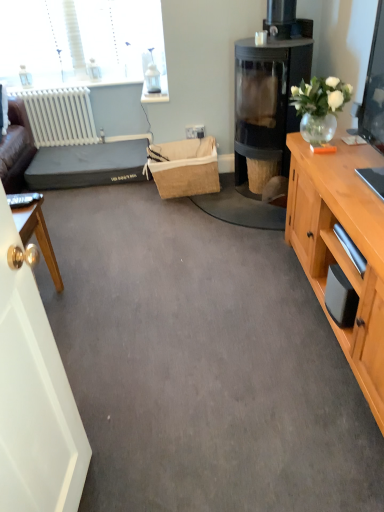
Question: Is white glossy door at left far away from polished wood desk at left?

Choices:
 (A) yes
 (B) no

Answer: (B)

Question: From the image's perspective, does white glossy door at left appear lower than polished wood desk at left?

Choices:
 (A) yes
 (B) no

Answer: (A)

Question: Is white glossy door at left closer to camera compared to polished wood desk at left?

Choices:
 (A) no
 (B) yes

Answer: (B)

Question: From the image's perspective, is white glossy door at left located above polished wood desk at left?

Choices:
 (A) no
 (B) yes

Answer: (A)

Question: Considering the relative sizes of white glossy door at left and polished wood desk at left in the image provided, is white glossy door at left shorter than polished wood desk at left?

Choices:
 (A) no
 (B) yes

Answer: (A)

Question: Is white glossy door at left at the left side of polished wood desk at left?

Choices:
 (A) no
 (B) yes

Answer: (A)

Question: Is white glossy door at left bigger than white matte radiator at left?

Choices:
 (A) no
 (B) yes

Answer: (B)

Question: Is white glossy door at left taller than white matte radiator at left?

Choices:
 (A) no
 (B) yes

Answer: (B)

Question: Is there a large distance between white glossy door at left and white matte radiator at left?

Choices:
 (A) no
 (B) yes

Answer: (B)

Question: Is white glossy door at left wider than white matte radiator at left?

Choices:
 (A) yes
 (B) no

Answer: (A)

Question: Considering the relative positions of white glossy door at left and white matte radiator at left in the image provided, is white glossy door at left behind white matte radiator at left?

Choices:
 (A) no
 (B) yes

Answer: (A)

Question: From the image's perspective, is white glossy door at left located above white matte radiator at left?

Choices:
 (A) no
 (B) yes

Answer: (A)

Question: Could you tell me if clear glass vase at upper right is facing polished wood desk at left?

Choices:
 (A) yes
 (B) no

Answer: (A)